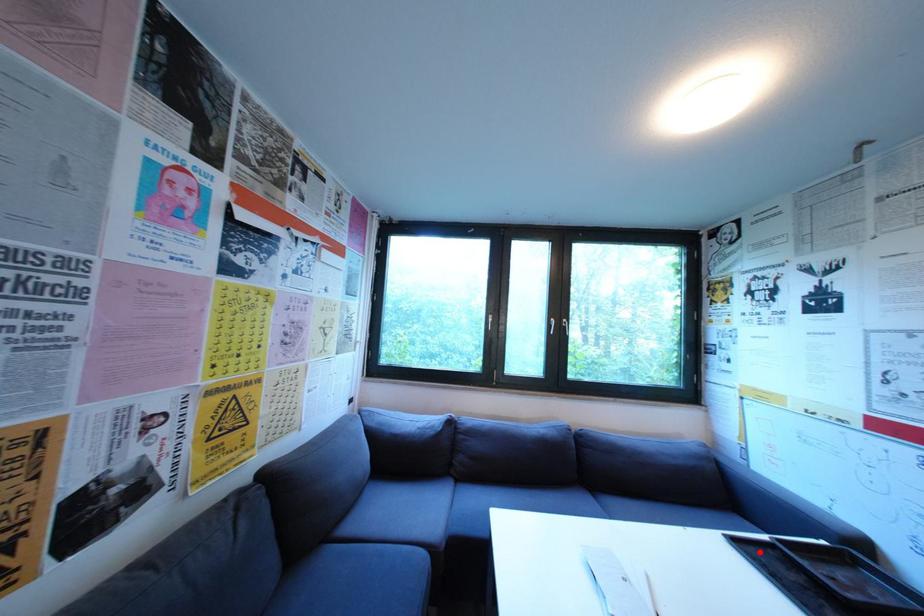
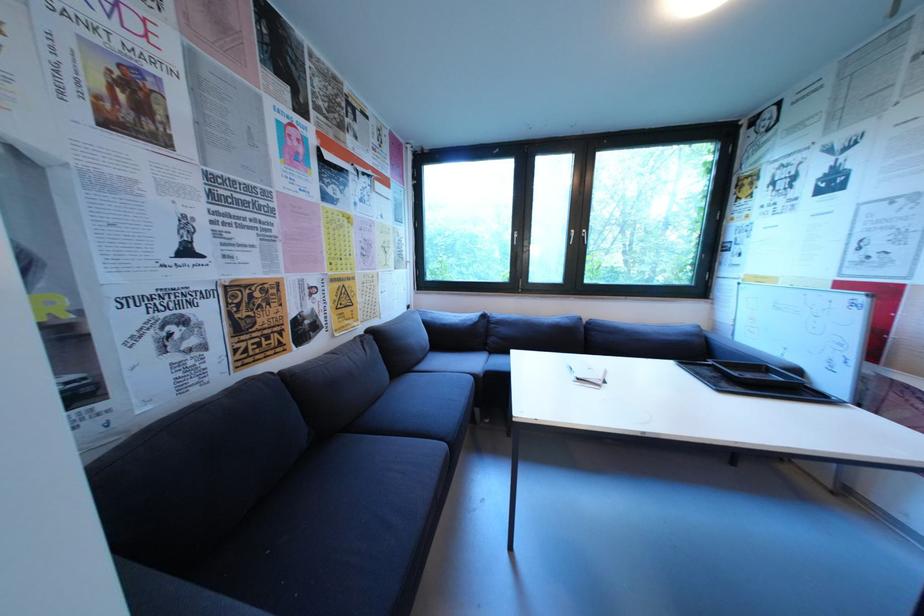
In the second image, find the point that corresponds to the highlighted location in the first image.

(699, 369)